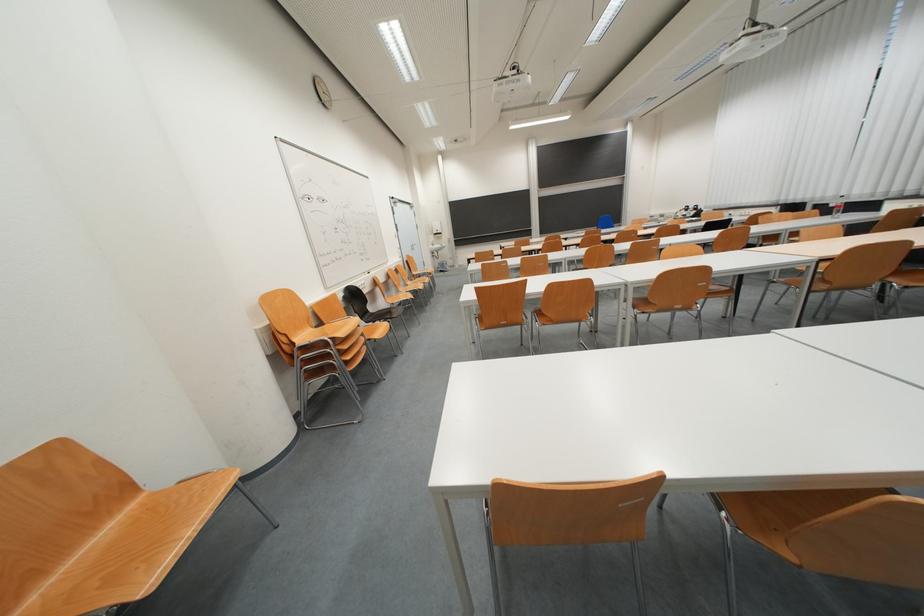
The width and height of the screenshot is (924, 616). Describe the element at coordinates (414, 246) in the screenshot. I see `the door handle` at that location.